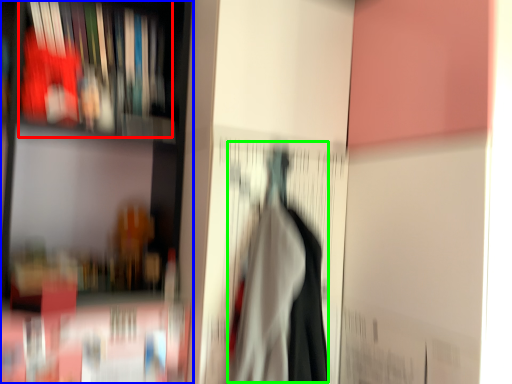
Question: Based on their relative distances, which object is nearer to book (highlighted by a red box)? Choose from shelf (highlighted by a blue box) and woman (highlighted by a green box).

Choices:
 (A) shelf
 (B) woman

Answer: (A)